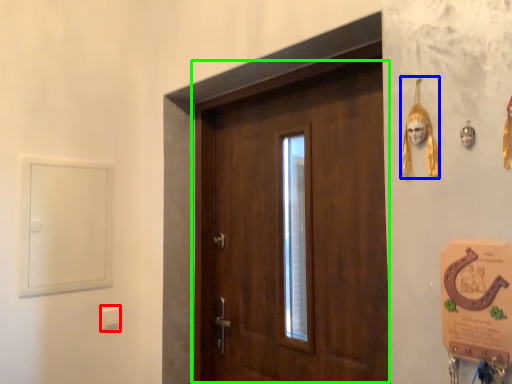
Question: Which object is positioned farthest from light switch (highlighted by a red box)? Select from decor (highlighted by a blue box) and door (highlighted by a green box).

Choices:
 (A) decor
 (B) door

Answer: (A)